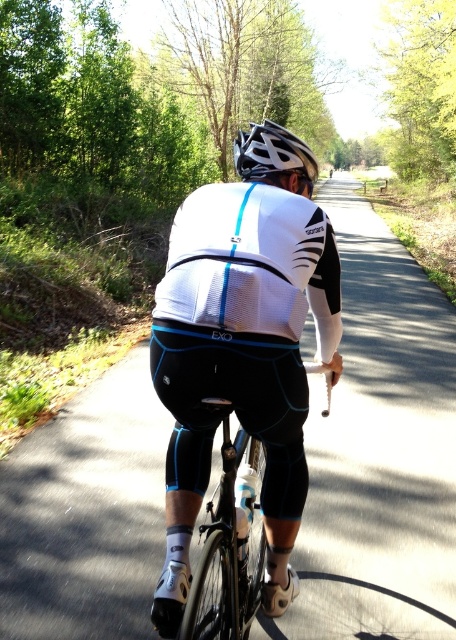
You are a drone operator trying to capture a photo of the cyclist. You need to position your drone between the two points, point (x=253, y=445) and point (x=273, y=168). Which point is closer to the cyclist so you can get a better shot?

Point (x=273, y=168) is closer to the cyclist because it is less further to the viewer than point (x=253, y=445), which is further away.

You are a photographer trying to capture the cyclist from above. You notice the black matte bicycle at center and the white matte bicycle helmet at center. Which object should you focus on if you want to photograph the taller object?

The white matte bicycle helmet at center is taller than the black matte bicycle at center, so you should focus on the white matte bicycle helmet at center to capture the taller object.

From the picture: You are a photographer aiming to capture the cyclist in the scene. You want to ensure that both the white matte cycling jersey at center and the white matte bicycle helmet at center are clearly visible in your shot. Given their sizes, which object should you focus on first to ensure proper exposure, and why?

The white matte cycling jersey at center has a smaller size compared to the white matte bicycle helmet at center. Since the jersey is smaller, you should focus on the helmet first to ensure its details are captured properly, as larger objects often require more attention to exposure settings to avoid overexposure or underexposure.